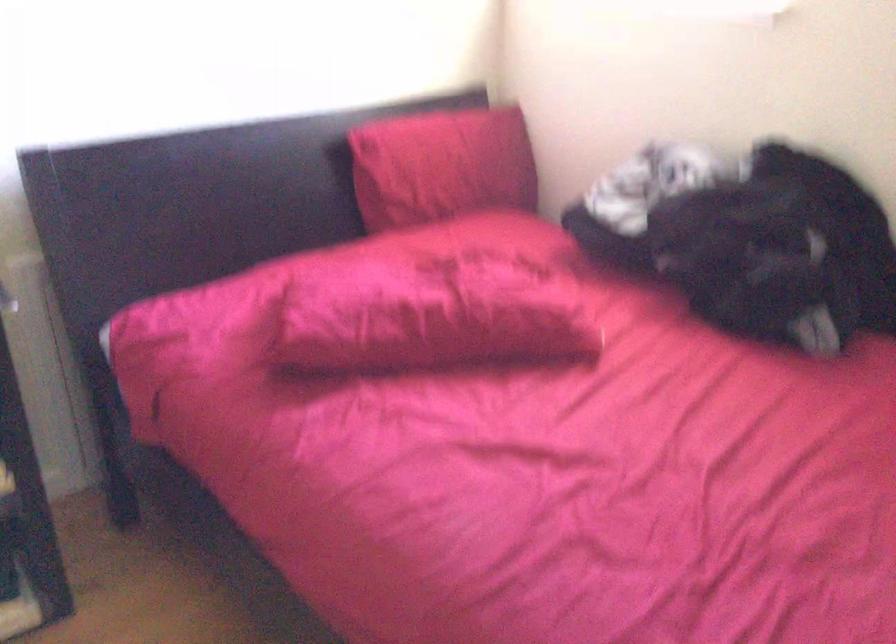
The image size is (896, 644). What are the coordinates of `red rectangular pillow` in the screenshot? It's located at (442, 166).